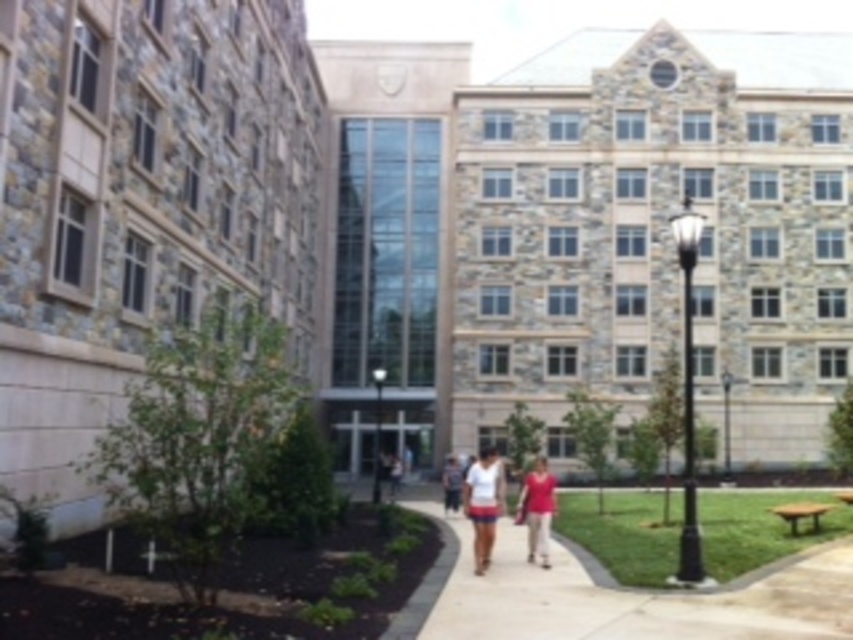
Does white cotton shirt at center appear over matte pink shirt at center?

Yes.

Is white cotton shirt at center further to camera compared to matte pink shirt at center?

No, it is not.

Who is more distant from viewer, (492, 536) or (541, 502)?

Point (541, 502)

This screenshot has width=853, height=640. I want to click on white cotton shirt at center, so click(485, 502).